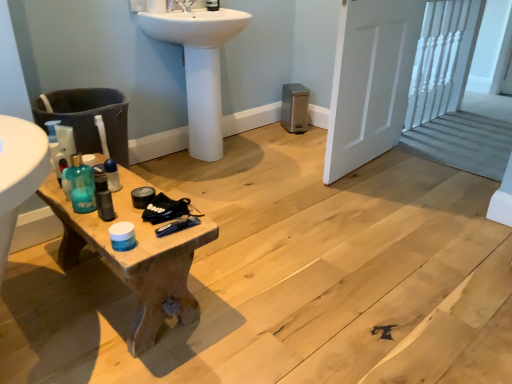
I want to click on vacant region to the right of woodenwoodentable at left, so click(x=264, y=285).